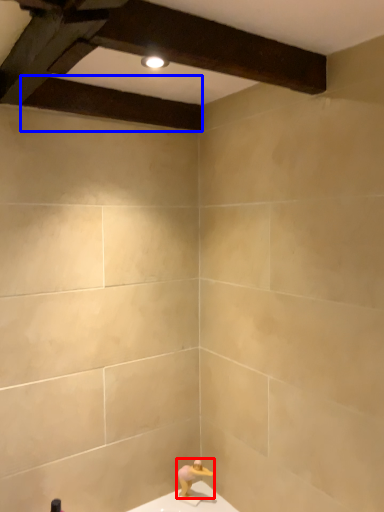
Question: Which object appears closest to the camera in this image, person (highlighted by a red box) or plank (highlighted by a blue box)?

Choices:
 (A) person
 (B) plank

Answer: (B)